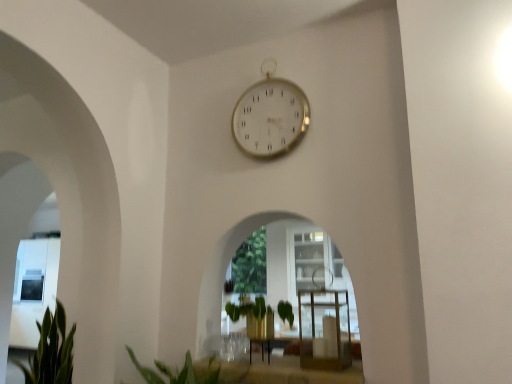
Question: From a real-world perspective, is gold metallic clock at upper center below clear glass table at center?

Choices:
 (A) no
 (B) yes

Answer: (A)

Question: Are gold metallic clock at upper center and clear glass table at center far apart?

Choices:
 (A) yes
 (B) no

Answer: (B)

Question: Considering the relative sizes of gold metallic clock at upper center and clear glass table at center in the image provided, is gold metallic clock at upper center wider than clear glass table at center?

Choices:
 (A) no
 (B) yes

Answer: (A)

Question: Is gold metallic clock at upper center to the right of clear glass table at center from the viewer's perspective?

Choices:
 (A) yes
 (B) no

Answer: (B)

Question: Is gold metallic clock at upper center closer to the viewer compared to clear glass table at center?

Choices:
 (A) yes
 (B) no

Answer: (B)

Question: Is point (330, 291) closer or farther from the camera than point (300, 102)?

Choices:
 (A) closer
 (B) farther

Answer: (A)

Question: Looking at their shapes, would you say clear glass table at center is wider or thinner than gold metallic clock at upper center?

Choices:
 (A) wide
 (B) thin

Answer: (A)

Question: Is clear glass table at center situated inside gold metallic clock at upper center or outside?

Choices:
 (A) outside
 (B) inside

Answer: (A)

Question: Considering the positions of clear glass table at center and gold metallic clock at upper center in the image, is clear glass table at center taller or shorter than gold metallic clock at upper center?

Choices:
 (A) short
 (B) tall

Answer: (A)

Question: From the image's perspective, is clear glass table at center located above or below green leafy plant at center?

Choices:
 (A) below
 (B) above

Answer: (B)

Question: From a real-world perspective, is clear glass table at center above or below green leafy plant at center?

Choices:
 (A) above
 (B) below

Answer: (B)

Question: Do you think clear glass table at center is within green leafy plant at center, or outside of it?

Choices:
 (A) outside
 (B) inside

Answer: (A)

Question: Considering the positions of clear glass table at center and green leafy plant at center in the image, is clear glass table at center taller or shorter than green leafy plant at center?

Choices:
 (A) tall
 (B) short

Answer: (B)

Question: Is green leafy plant at center taller or shorter than green leafy plant at lower left?

Choices:
 (A) tall
 (B) short

Answer: (A)

Question: Is green leafy plant at center situated inside green leafy plant at lower left or outside?

Choices:
 (A) outside
 (B) inside

Answer: (A)